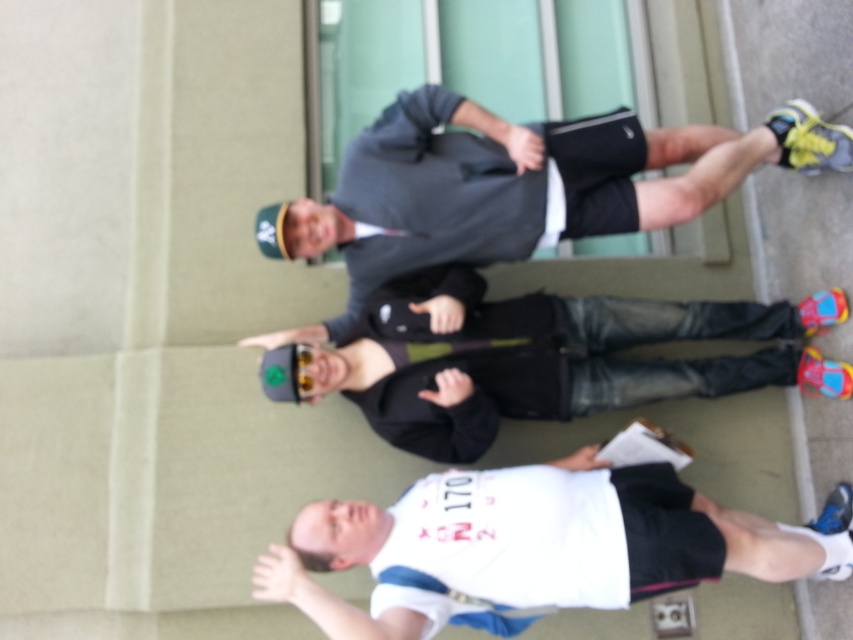
Question: Which of the following is the farthest from the observer?

Choices:
 (A) (387, 145)
 (B) (363, 620)

Answer: (A)

Question: Which point appears closest to the camera in this image?

Choices:
 (A) (633, 324)
 (B) (456, 196)
 (C) (583, 564)

Answer: (C)

Question: Is dark gray jacket at upper center bigger than white matte shirt at lower center?

Choices:
 (A) yes
 (B) no

Answer: (B)

Question: Which object is the farthest from the white matte shirt at lower center?

Choices:
 (A) black leather jacket at center
 (B) dark gray jacket at upper center

Answer: (B)

Question: Considering the relative positions of black leather jacket at center and white matte shirt at lower center in the image provided, where is black leather jacket at center located with respect to white matte shirt at lower center?

Choices:
 (A) above
 (B) below

Answer: (A)

Question: Is dark gray jacket at upper center wider than black leather jacket at center?

Choices:
 (A) no
 (B) yes

Answer: (A)